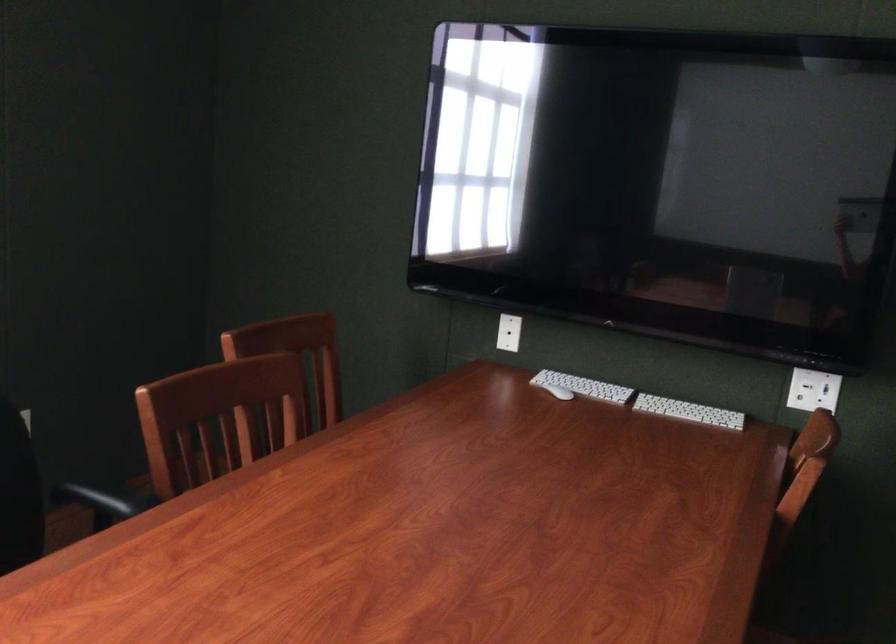
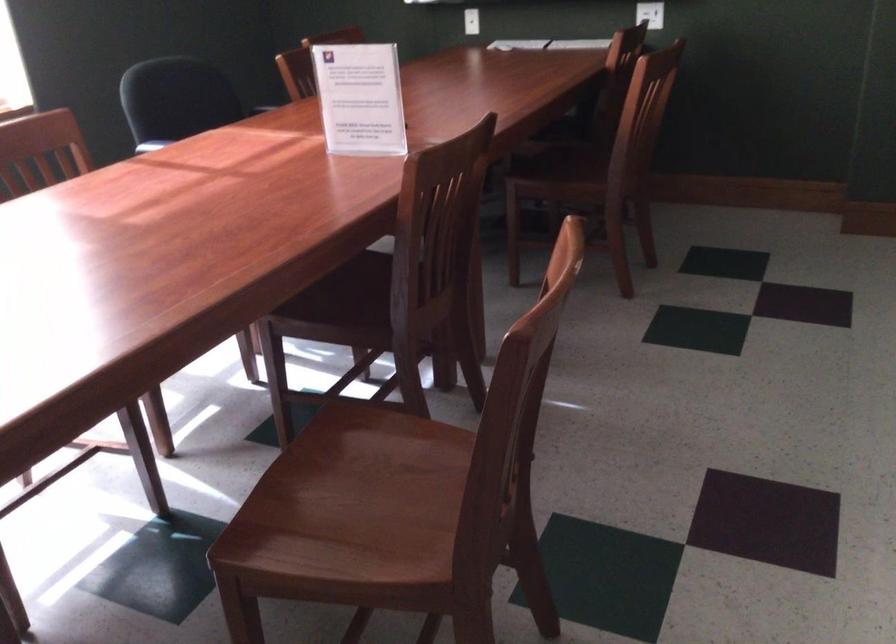
In the second image, find the point that corresponds to point 825,402 in the first image.

(650, 14)